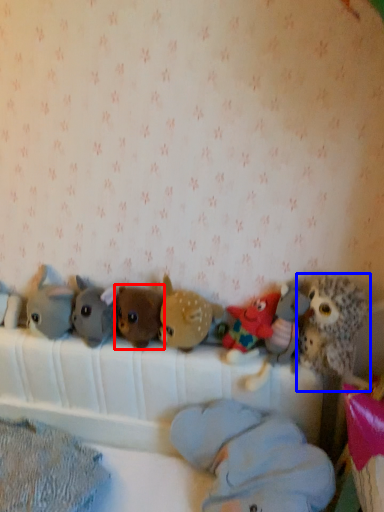
Question: Among these objects, which one is farthest to the camera, toy (highlighted by a red box) or toy (highlighted by a blue box)?

Choices:
 (A) toy
 (B) toy

Answer: (A)